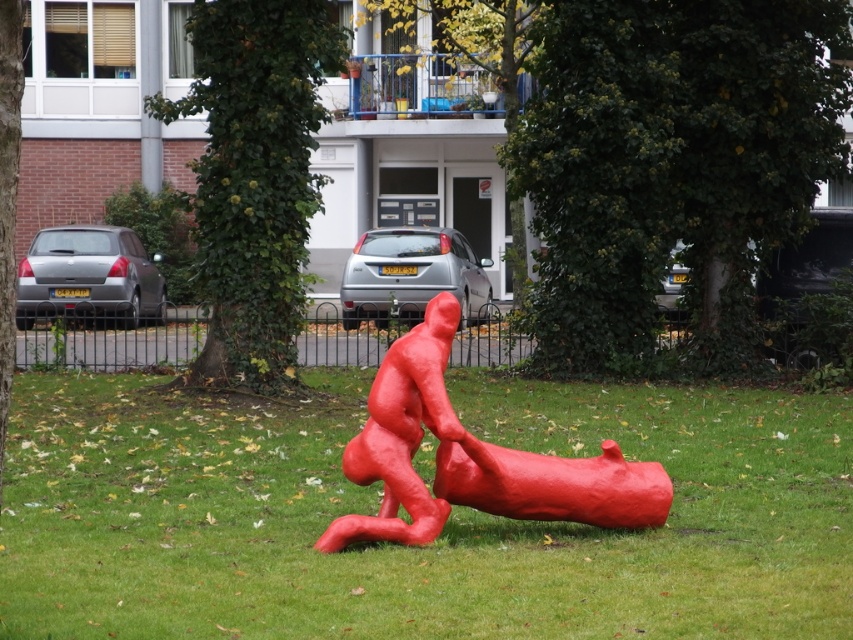
You are standing at the edge of the park and see the vibrant red sculpture. Where is the green grass at center located in relation to the sculpture?

The green grass at center is located at point (444,525) relative to the sculpture.

You are planning to place a new bench in the park. The bench requires a space that is larger than the matte red figure at center. Based on the scene, is the green grass at center a suitable location for the bench?

The green grass at center has a larger size compared to the matte red figure at center, so it is suitable for placing the bench as it provides enough space.

You are standing at the edge of the park and see the green grass at center and the matte red figure at center. Which object is positioned to the left from your perspective?

The green grass at center is positioned to the left of the matte red figure at center from your perspective.